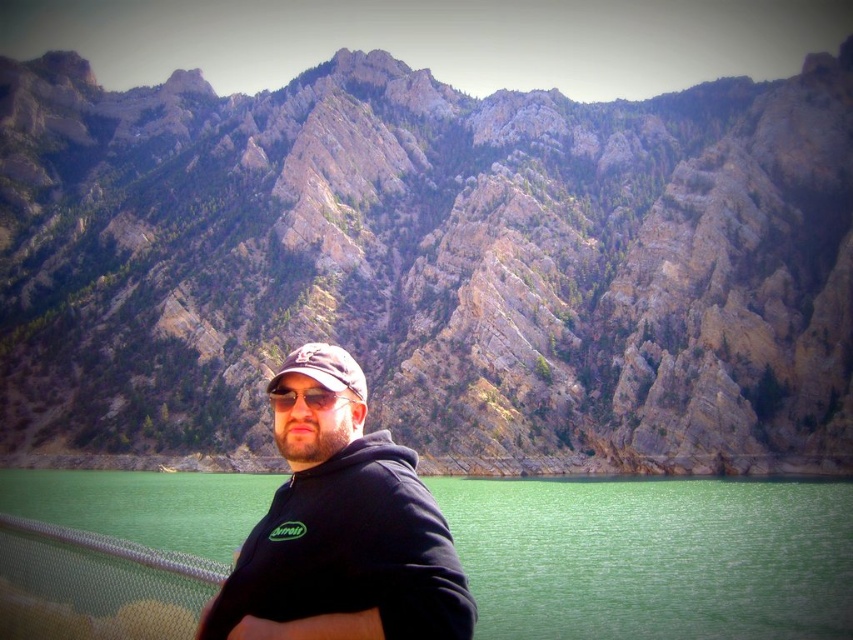
Is black matte hoodie at center positioned behind matte black sunglasses at center?

That is False.

Which is below, black matte hoodie at center or matte black sunglasses at center?

matte black sunglasses at center

You are a GUI agent. You are given a task and a screenshot of the screen. Output one action in this format:
    pyautogui.click(x=<x>, y=<y>)
    Task: Click on the black matte hoodie at center
    
    Given the screenshot: What is the action you would take?
    pyautogui.click(x=341, y=531)

Which is below, green smooth water at center or matte black sunglasses at center?

green smooth water at center is below.

Which of these two, green smooth water at center or matte black sunglasses at center, stands shorter?

Standing shorter between the two is green smooth water at center.

Who is more forward, (45, 490) or (277, 406)?

Point (277, 406)

Find the location of a particular element. This screenshot has width=853, height=640. green smooth water at center is located at coordinates (654, 556).

Between rocky gray mountain at center and matte black baseball cap at center, which one has more height?

Standing taller between the two is rocky gray mountain at center.

Does point (688, 403) come closer to viewer compared to point (347, 356)?

No, it is not.

At what (x,y) coordinates should I click in order to perform the action: click on rocky gray mountain at center. Please return your answer as a coordinate pair (x, y). The image size is (853, 640). Looking at the image, I should click on tap(428, 266).